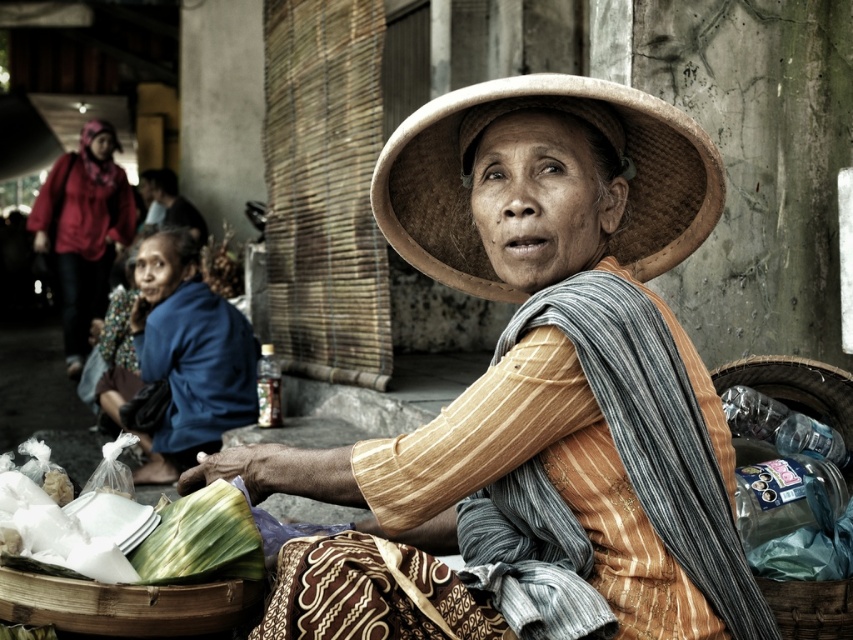
Can you confirm if blue fabric at lower left is positioned above brown woven basket at lower right?

Incorrect, blue fabric at lower left is not positioned above brown woven basket at lower right.

Is the position of blue fabric at lower left less distant than that of brown woven basket at lower right?

That is False.

Between point (148, 269) and point (780, 612), which one is positioned behind?

Positioned behind is point (148, 269).

Locate an element on the screen. blue fabric at lower left is located at coordinates pos(189,355).

Between brown woven straw hat at center and matte red jacket at upper left, which one is positioned lower?

Positioned lower is brown woven straw hat at center.

Can you confirm if brown woven straw hat at center is taller than matte red jacket at upper left?

No.

Identify the location of brown woven straw hat at center. (567, 113).

What do you see at coordinates (189, 355) in the screenshot? The height and width of the screenshot is (640, 853). I see `blue fabric at lower left` at bounding box center [189, 355].

In the scene shown: Is blue fabric at lower left bigger than matte red jacket at upper left?

No, blue fabric at lower left is not bigger than matte red jacket at upper left.

Where is `blue fabric at lower left`? The height and width of the screenshot is (640, 853). blue fabric at lower left is located at coordinates (189, 355).